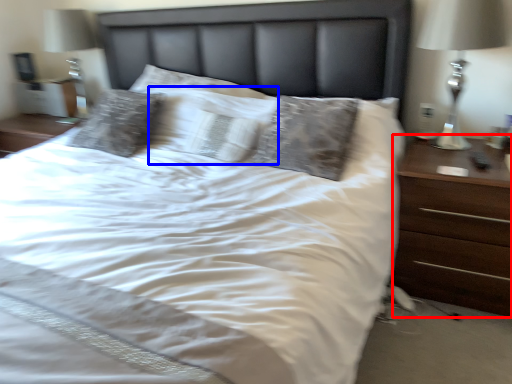
Question: Which of the following is the closest to the observer, nightstand (highlighted by a red box) or pillow (highlighted by a blue box)?

Choices:
 (A) nightstand
 (B) pillow

Answer: (A)